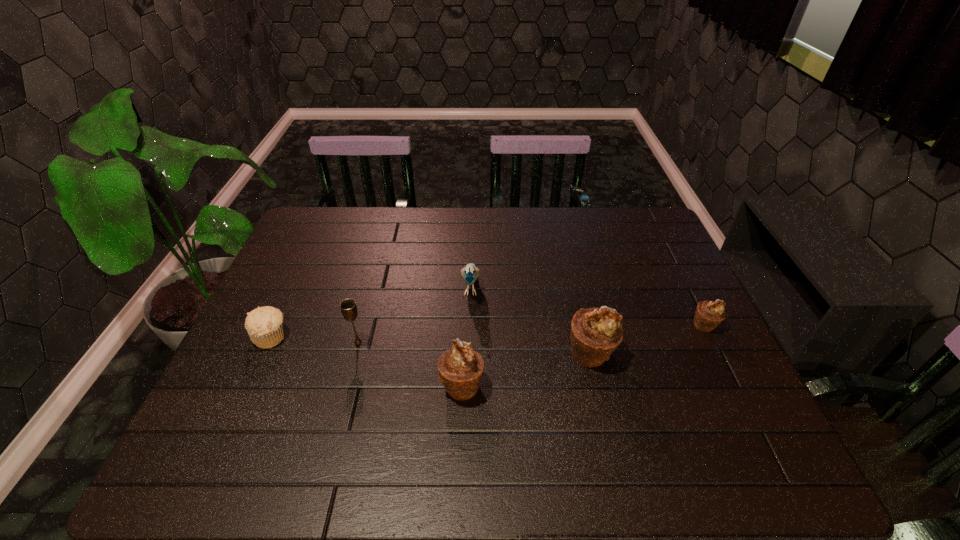
I want to click on the second tallest muffin, so pos(460,369).

I want to click on the third muffin from left to right, so click(x=595, y=333).

You are a GUI agent. You are given a task and a screenshot of the screen. Output one action in this format:
    pyautogui.click(x=<x>, y=<y>)
    Task: Click on the rightmost muffin
    Image resolution: width=960 pixels, height=540 pixels.
    Given the screenshot: What is the action you would take?
    (x=708, y=314)

Where is `chalice`? This screenshot has width=960, height=540. chalice is located at coordinates [x=348, y=307].

Identify the location of bird. coord(470,273).

Identify the location of the leftmost object. Image resolution: width=960 pixels, height=540 pixels. (264, 325).

Image resolution: width=960 pixels, height=540 pixels. Find the location of `free space located on the back of the second tallest muffin`. free space located on the back of the second tallest muffin is located at coordinates (464, 324).

The image size is (960, 540). I want to click on vacant area located on the right of the fifth object from left to right, so 679,353.

Find the location of a particular element. The image size is (960, 540). free space located 0.230m on the left of the rightmost object is located at coordinates (605, 325).

The height and width of the screenshot is (540, 960). I want to click on free space located on the left of the chalice, so click(x=316, y=342).